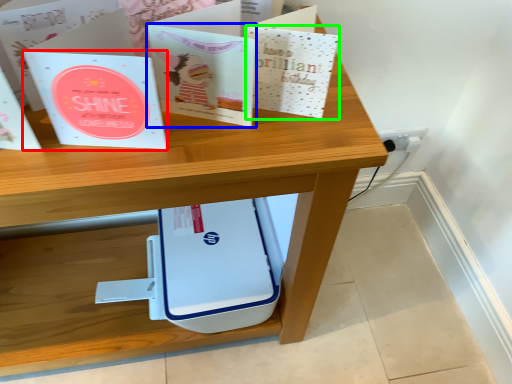
Question: Which object is the closest to the paperback book (highlighted by a red box)? Choose among these: paperback book (highlighted by a blue box) or paperback book (highlighted by a green box).

Choices:
 (A) paperback book
 (B) paperback book

Answer: (A)